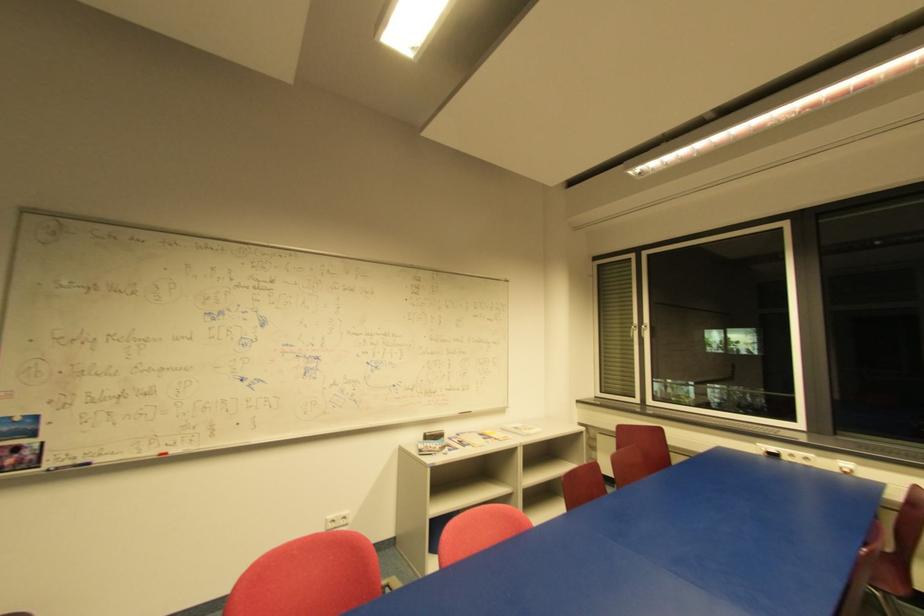
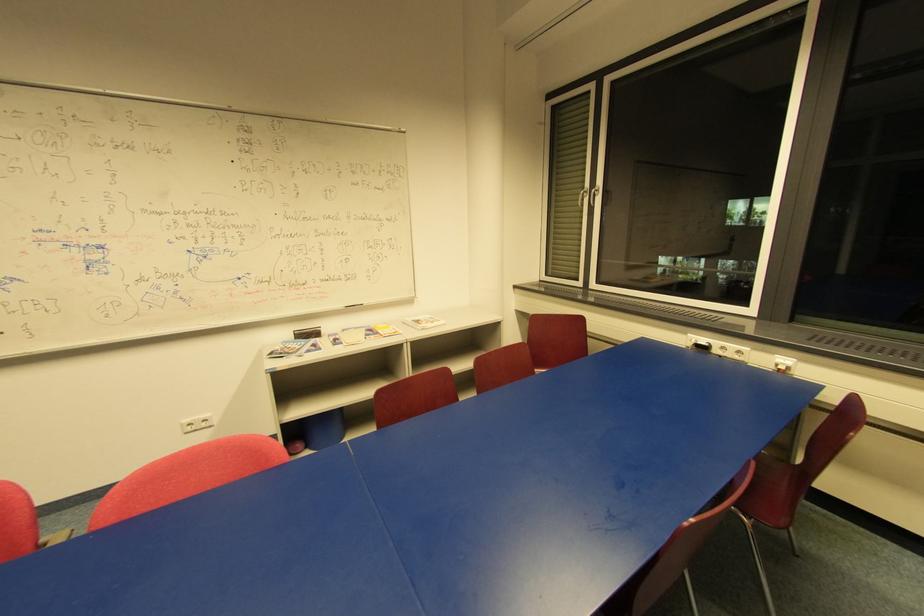
Locate, in the second image, the point that corresponds to (x=849, y=472) in the first image.

(785, 369)